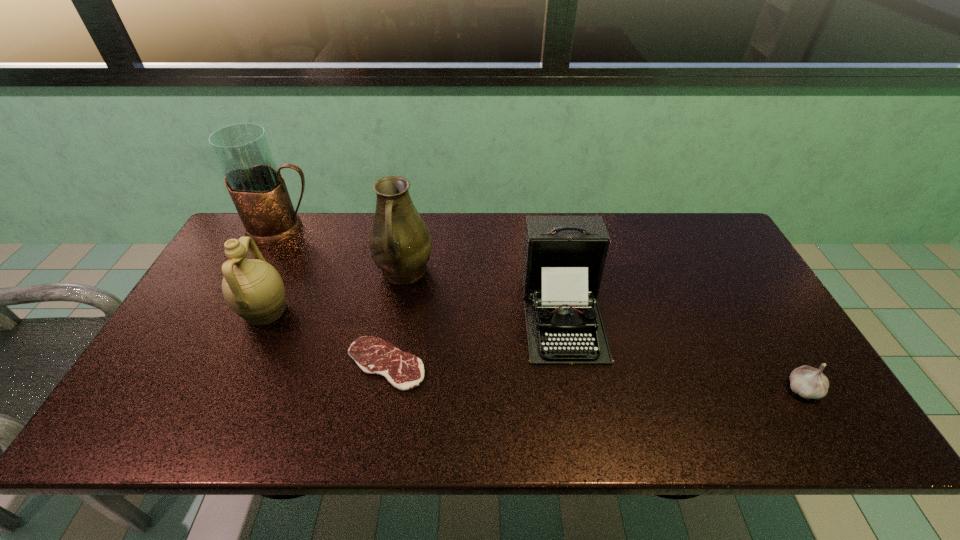
What are the coordinates of `vacant region located on the back of the shortest pitcher` in the screenshot? It's located at (283, 273).

You are a GUI agent. You are given a task and a screenshot of the screen. Output one action in this format:
    pyautogui.click(x=<x>, y=<y>)
    Task: Click on the free space located 0.150m inside the open case of the second object from right to left
    
    Given the screenshot: What is the action you would take?
    pyautogui.click(x=582, y=422)

The width and height of the screenshot is (960, 540). Identify the location of free space located 0.200m on the back of the rightmost object. (757, 313).

The image size is (960, 540). What are the coordinates of `vacant space situated on the left of the steak` in the screenshot? It's located at (290, 363).

Locate an element on the screen. Image resolution: width=960 pixels, height=540 pixels. object that is at the right edge is located at coordinates (808, 382).

Locate an element on the screen. The image size is (960, 540). object present at the far left corner is located at coordinates (257, 188).

You are a GUI agent. You are given a task and a screenshot of the screen. Output one action in this format:
    pyautogui.click(x=<x>, y=<y>)
    Task: Click on the vacant space at the far edge
    This screenshot has width=960, height=540.
    Given the screenshot: What is the action you would take?
    pyautogui.click(x=492, y=254)

Find the location of a particular element. Image resolution: width=960 pixels, height=540 pixels. vacant space at the near edge is located at coordinates (192, 442).

What are the coordinates of `free space at the left edge` in the screenshot? It's located at (193, 338).

Find the location of a particular element. The image size is (960, 540). vacant point at the right edge is located at coordinates (775, 330).